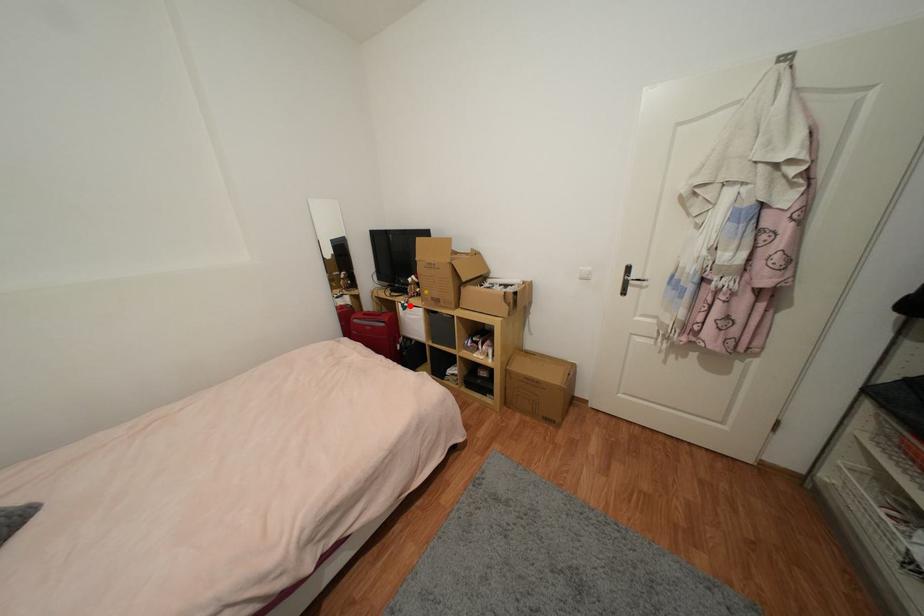
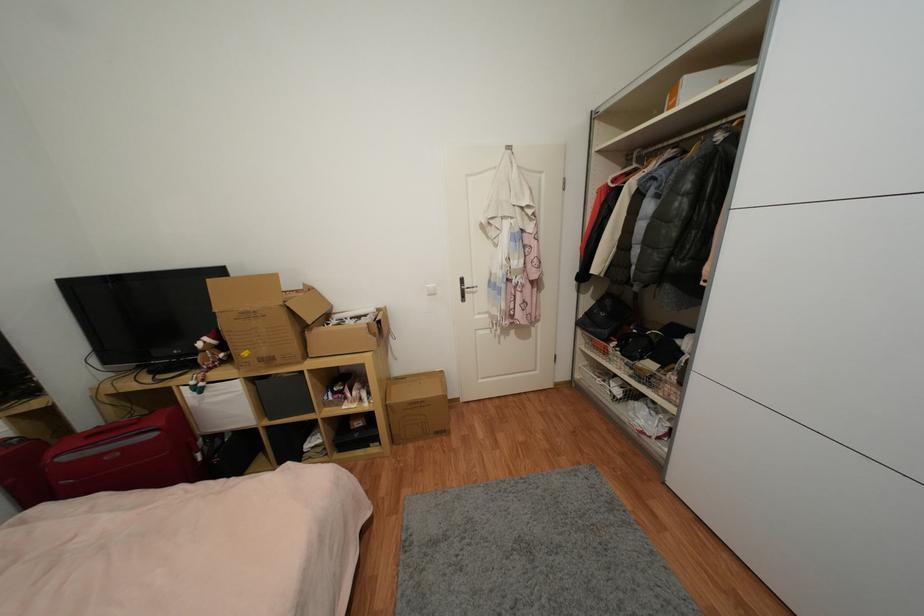
Where in the second image is the point corresponding to the highlighted location from the first image?

(205, 386)